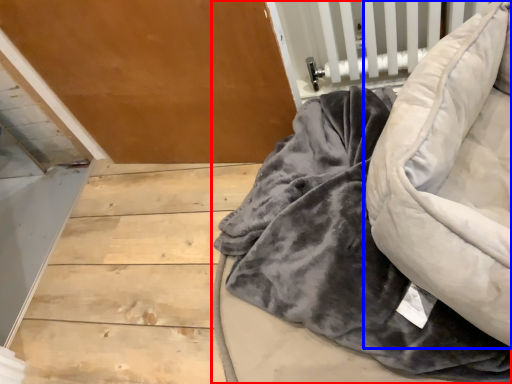
Question: Which point is closer to the camera, furniture (highlighted by a red box) or bean bag chair (highlighted by a blue box)?

Choices:
 (A) furniture
 (B) bean bag chair

Answer: (B)